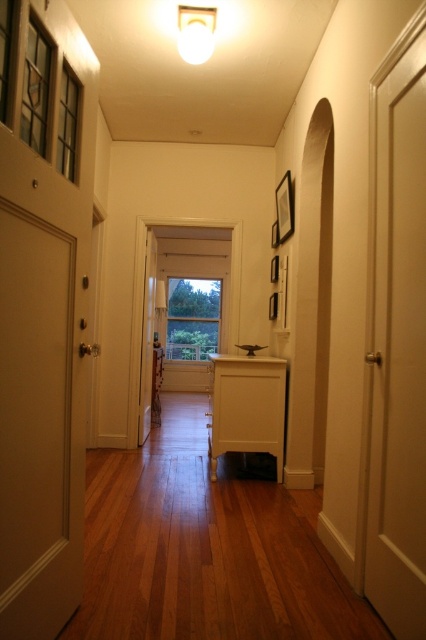
Question: Which point is closer to the camera taking this photo?

Choices:
 (A) (14, 445)
 (B) (408, 42)

Answer: (A)

Question: Observing the image, what is the correct spatial positioning of white matte door at right in reference to white matte door at left?

Choices:
 (A) above
 (B) below

Answer: (A)

Question: Does white matte door at right have a lesser width compared to white matte door at left?

Choices:
 (A) no
 (B) yes

Answer: (A)

Question: Can you confirm if white matte door at right is smaller than white matte door at left?

Choices:
 (A) no
 (B) yes

Answer: (A)

Question: Which of the following is the closest to the observer?

Choices:
 (A) (8, 493)
 (B) (371, 355)

Answer: (A)